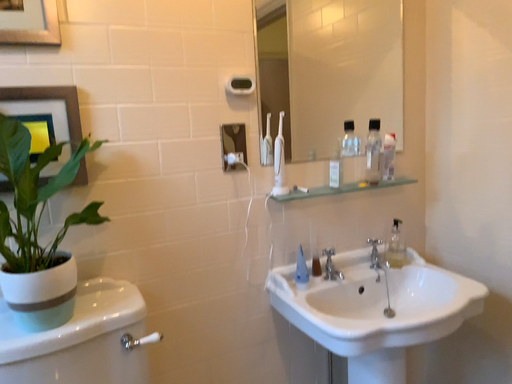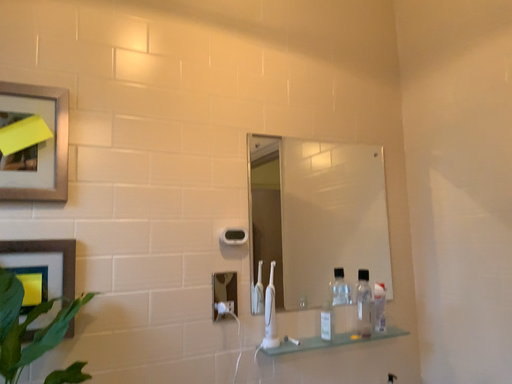
Question: Which way did the camera rotate in the video?

Choices:
 (A) rotated downward
 (B) rotated upward

Answer: (B)